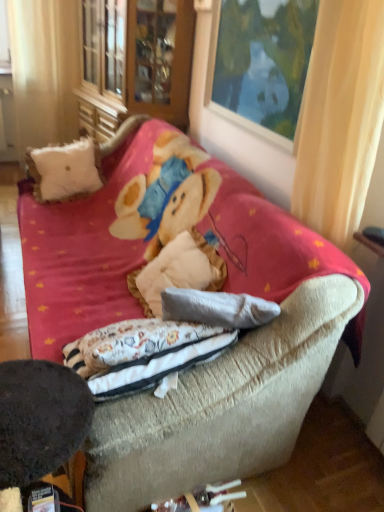
Question: From the image's perspective, relative to dark brown felt round table at lower left, is white fabric curtain at left, the second curtain positioned from the bottom, above or below?

Choices:
 (A) below
 (B) above

Answer: (B)

Question: Does point (23, 5) appear closer or farther from the camera than point (21, 446)?

Choices:
 (A) closer
 (B) farther

Answer: (B)

Question: Based on their relative distances, which object is nearer to the wooden picture frame at upper center?

Choices:
 (A) dark brown felt round table at lower left
 (B) white fabric curtain at left, the second curtain positioned from the bottom
 (C) yellow fabric curtain at upper right, the second curtain from the left
 (D) wooden cabinet at upper left
 (E) velvet beige couch at center

Answer: (C)

Question: Which object is the closest to the wooden cabinet at upper left?

Choices:
 (A) white fluffy pillow at upper left
 (B) dark brown felt round table at lower left
 (C) wooden picture frame at upper center
 (D) yellow fabric curtain at upper right, which is the 2th curtain in back-to-front order
 (E) white fabric curtain at left, placed as the first curtain when sorted from top to bottom

Answer: (E)